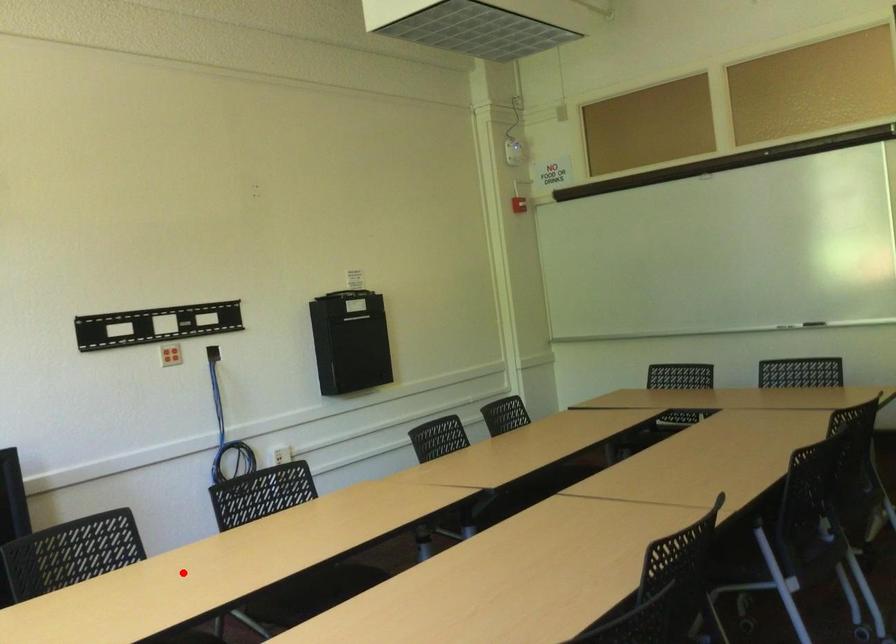
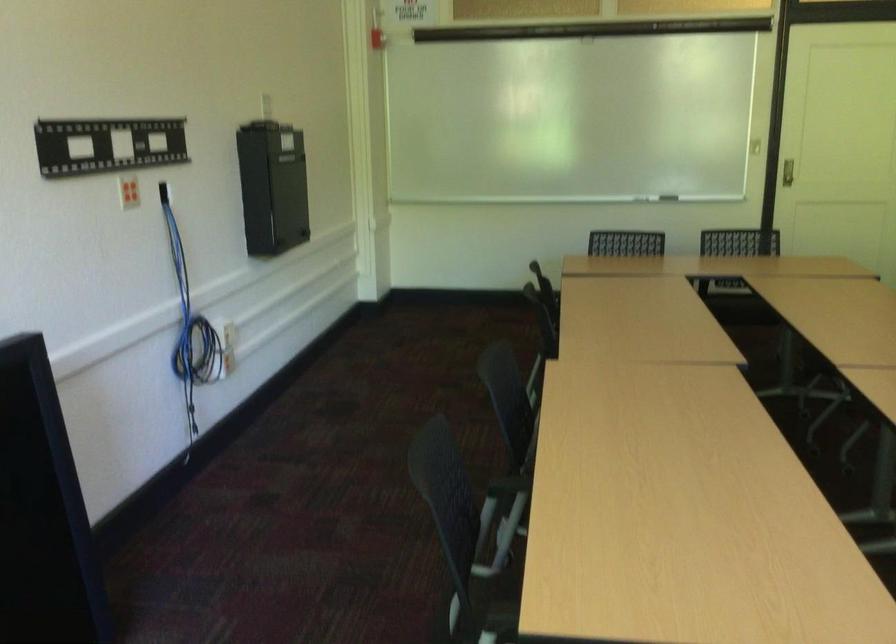
Question: I am providing you with two images of the same scene from different viewpoints. A red point is shown in image1. For the corresponding object point in image2, is it positioned nearer or farther from the camera?

Choices:
 (A) Nearer
 (B) Farther

Answer: (A)